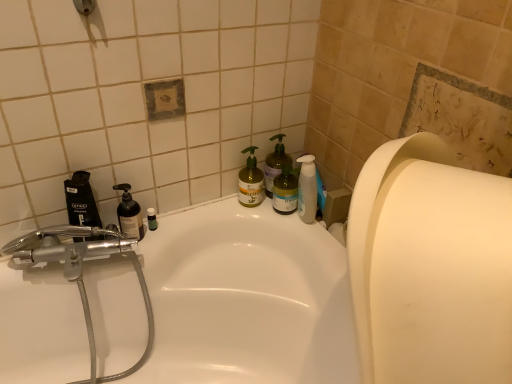
Measure the distance between green matte bottle at center, the second cleaning product viewed from the right, and camera.

A distance of 1.30 meters exists between green matte bottle at center, the second cleaning product viewed from the right, and camera.

The image size is (512, 384). In order to click on green matte bottle at center, the second cleaning product viewed from the right in this screenshot , I will do `click(250, 181)`.

Image resolution: width=512 pixels, height=384 pixels. Describe the element at coordinates (152, 219) in the screenshot. I see `transparent plastic bottle at left` at that location.

You are a GUI agent. You are given a task and a screenshot of the screen. Output one action in this format:
    pyautogui.click(x=<x>, y=<y>)
    Task: Click on the white matte paper towel at right
    
    Given the screenshot: What is the action you would take?
    pyautogui.click(x=431, y=267)

What is the approximate width of white matte paper towel at right?

It is 17.82 inches.

This screenshot has height=384, width=512. Describe the element at coordinates (275, 163) in the screenshot. I see `green matte pump bottle at upper right, which is counted as the first cleaning product, starting from the right` at that location.

The height and width of the screenshot is (384, 512). What do you see at coordinates (81, 201) in the screenshot? I see `black plastic mouthwash at left` at bounding box center [81, 201].

Identify the location of matte silver showerhead at upper left. The width and height of the screenshot is (512, 384). (85, 6).

The width and height of the screenshot is (512, 384). What do you see at coordinates (82, 272) in the screenshot? I see `chrome metallic faucet at left` at bounding box center [82, 272].

You are a GUI agent. You are given a task and a screenshot of the screen. Output one action in this format:
    pyautogui.click(x=<x>, y=<y>)
    Task: Click on the green matte bottle at center, the 2th cleaning product positioned from the left
    This screenshot has height=384, width=512.
    Given the screenshot: What is the action you would take?
    pyautogui.click(x=250, y=181)

Does matte silver showerhead at upper left turn towards white glossy bathtub at center?

No, matte silver showerhead at upper left does not turn towards white glossy bathtub at center.

Is matte silver showerhead at upper left not inside white glossy bathtub at center?

Yes, matte silver showerhead at upper left is located beyond the bounds of white glossy bathtub at center.

Which is behind, matte silver showerhead at upper left or white glossy bathtub at center?

matte silver showerhead at upper left.

How different are the orientations of matte silver showerhead at upper left and white glossy bathtub at center in degrees?

There is a 1.04-degree angle between the facing directions of matte silver showerhead at upper left and white glossy bathtub at center.

Considering the relative sizes of white glossy bathtub at center and matte black pump bottle at left, placed as the 1th cleaning product when sorted from left to right, in the image provided, is white glossy bathtub at center thinner than matte black pump bottle at left, placed as the 1th cleaning product when sorted from left to right,?

No, white glossy bathtub at center is not thinner than matte black pump bottle at left, placed as the 1th cleaning product when sorted from left to right.

Is there a large distance between white glossy bathtub at center and matte black pump bottle at left, placed as the 1th cleaning product when sorted from left to right?

Actually, white glossy bathtub at center and matte black pump bottle at left, placed as the 1th cleaning product when sorted from left to right, are a little close together.

Is the depth of white glossy bathtub at center greater than that of matte black pump bottle at left, placed as the 1th cleaning product when sorted from left to right?

No.

Which is more to the right, matte black pump bottle at left, the third cleaning product from the right, or white matte paper towel at right?

From the viewer's perspective, white matte paper towel at right appears more on the right side.

Which object is wider, matte black pump bottle at left, placed as the 1th cleaning product when sorted from left to right, or white matte paper towel at right?

white matte paper towel at right is wider.

From a real-world perspective, which is physically above, matte black pump bottle at left, the third cleaning product from the right, or white matte paper towel at right?

In real-world perspective, white matte paper towel at right is above.

Measure the distance between matte black pump bottle at left, placed as the 1th cleaning product when sorted from left to right, and white matte paper towel at right.

matte black pump bottle at left, placed as the 1th cleaning product when sorted from left to right, is 29.98 inches away from white matte paper towel at right.

Between chrome metallic faucet at left and black plastic mouthwash at left, which one has more height?

Standing taller between the two is chrome metallic faucet at left.

Can you tell me how much chrome metallic faucet at left and black plastic mouthwash at left differ in facing direction?

The angular difference between chrome metallic faucet at left and black plastic mouthwash at left is 5.01 degrees.

Is chrome metallic faucet at left touching black plastic mouthwash at left?

chrome metallic faucet at left and black plastic mouthwash at left are not in contact.

Based on their sizes in the image, would you say chrome metallic faucet at left is bigger or smaller than black plastic mouthwash at left?

In the image, chrome metallic faucet at left appears to be larger than black plastic mouthwash at left.

Considering the relative sizes of transparent plastic bottle at left and green matte bottle at center, the 2th cleaning product positioned from the left, in the image provided, is transparent plastic bottle at left taller than green matte bottle at center, the 2th cleaning product positioned from the left,?

No, transparent plastic bottle at left is not taller than green matte bottle at center, the 2th cleaning product positioned from the left.

Is transparent plastic bottle at left outside of green matte bottle at center, the second cleaning product viewed from the right?

transparent plastic bottle at left lies outside green matte bottle at center, the second cleaning product viewed from the right,'s area.

Which object is positioned more to the right, transparent plastic bottle at left or green matte bottle at center, the 2th cleaning product positioned from the left?

From the viewer's perspective, green matte bottle at center, the 2th cleaning product positioned from the left, appears more on the right side.

In terms of size, does transparent plastic bottle at left appear bigger or smaller than green matte bottle at center, the 2th cleaning product positioned from the left?

Clearly, transparent plastic bottle at left is smaller in size than green matte bottle at center, the 2th cleaning product positioned from the left.

Can you confirm if green matte bottle at center, the 2th cleaning product positioned from the left, is thinner than transparent plastic bottle at left?

Incorrect, the width of green matte bottle at center, the 2th cleaning product positioned from the left, is not less than that of transparent plastic bottle at left.

Is the surface of green matte bottle at center, the second cleaning product viewed from the right, in direct contact with transparent plastic bottle at left?

No, green matte bottle at center, the second cleaning product viewed from the right, is not touching transparent plastic bottle at left.

Considering the positions of points (255, 184) and (149, 221), is point (255, 184) farther from camera compared to point (149, 221)?

That is True.

Is transparent plastic bottle at left positioned with its back to matte silver showerhead at upper left?

No, transparent plastic bottle at left's orientation is not away from matte silver showerhead at upper left.

Considering the relative sizes of transparent plastic bottle at left and matte silver showerhead at upper left in the image provided, is transparent plastic bottle at left smaller than matte silver showerhead at upper left?

Yes.

Is transparent plastic bottle at left wider or thinner than matte silver showerhead at upper left?

Answer: transparent plastic bottle at left is thinner than matte silver showerhead at upper left.

Based on the photo, between transparent plastic bottle at left and matte silver showerhead at upper left, which one has less height?

matte silver showerhead at upper left.

This screenshot has height=384, width=512. Find the location of `shower above the white glossy bathtub at center (from a real-world perspective)`. shower above the white glossy bathtub at center (from a real-world perspective) is located at coordinates (85, 6).

Locate an element on the screen. This screenshot has height=384, width=512. bathtub that is in front of the matte black pump bottle at left, the third cleaning product from the right is located at coordinates (247, 299).

When comparing their distances from chrome metallic faucet at left, does green matte bottle at center, the 2th cleaning product positioned from the left, or transparent plastic bottle at left seem further?

green matte bottle at center, the 2th cleaning product positioned from the left, lies further to chrome metallic faucet at left than the other object.

Based on their spatial positions, is green matte bottle at center, the second cleaning product viewed from the right, or white matte paper towel at right closer to matte silver showerhead at upper left?

green matte bottle at center, the second cleaning product viewed from the right.

Looking at the image, which one is located further to green matte bottle at center, the second cleaning product viewed from the right, matte silver showerhead at upper left or green matte pump bottle at upper right, which is counted as the first cleaning product, starting from the right?

matte silver showerhead at upper left is further to green matte bottle at center, the second cleaning product viewed from the right.

Considering their positions, is green matte bottle at center, the second cleaning product viewed from the right, positioned closer to black plastic mouthwash at left than chrome metallic faucet at left?

Based on the image, chrome metallic faucet at left appears to be nearer to black plastic mouthwash at left.

From the image, which object appears to be farther from matte black pump bottle at left, the third cleaning product from the right, transparent plastic bottle at left or black plastic mouthwash at left?

The object further to matte black pump bottle at left, the third cleaning product from the right, is black plastic mouthwash at left.

Estimate the real-world distances between objects in this image. Which object is further from white glossy bathtub at center, matte black pump bottle at left, placed as the 1th cleaning product when sorted from left to right, or white matte paper towel at right?

Among the two, white matte paper towel at right is located further to white glossy bathtub at center.

From the image, which object appears to be nearer to green matte bottle at center, the 2th cleaning product positioned from the left, white matte paper towel at right or green matte pump bottle at upper right, positioned as the third cleaning product in left-to-right order?

green matte pump bottle at upper right, positioned as the third cleaning product in left-to-right order, is positioned closer to the anchor green matte bottle at center, the 2th cleaning product positioned from the left.

Looking at the image, which one is located further to matte silver showerhead at upper left, green matte pump bottle at upper right, which is counted as the first cleaning product, starting from the right, or matte black pump bottle at left, the third cleaning product from the right?

green matte pump bottle at upper right, which is counted as the first cleaning product, starting from the right.

You are a GUI agent. You are given a task and a screenshot of the screen. Output one action in this format:
    pyautogui.click(x=<x>, y=<y>)
    Task: Click on the plumbing fixture that lies between matte silver showerhead at upper left and white glossy bathtub at center from top to bottom
    
    Given the screenshot: What is the action you would take?
    pyautogui.click(x=82, y=272)

Where is `mouthwash between chrome metallic faucet at left and white matte paper towel at right`? This screenshot has width=512, height=384. mouthwash between chrome metallic faucet at left and white matte paper towel at right is located at coordinates (81, 201).

Where is `bathtub between white matte paper towel at right and matte black pump bottle at left, placed as the 1th cleaning product when sorted from left to right, from front to back`? bathtub between white matte paper towel at right and matte black pump bottle at left, placed as the 1th cleaning product when sorted from left to right, from front to back is located at coordinates (247, 299).

What are the coordinates of `shower situated between black plastic mouthwash at left and white matte paper towel at right from left to right` in the screenshot? It's located at (85, 6).